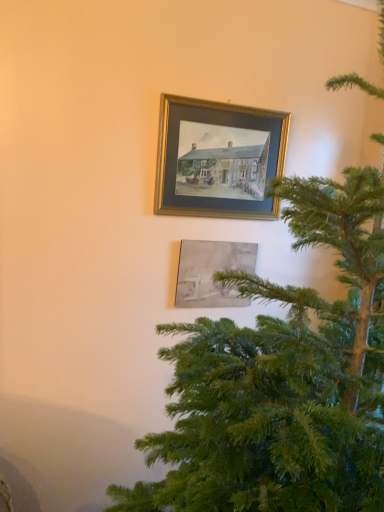
Question: Is gray matte painting at lower center, arranged as the 1th picture frame when ordered from the bottom, turned away from green textured christmas tree at right?

Choices:
 (A) yes
 (B) no

Answer: (B)

Question: Does gray matte painting at lower center, arranged as the second picture frame when viewed from the top, contain green textured christmas tree at right?

Choices:
 (A) yes
 (B) no

Answer: (B)

Question: Is gray matte painting at lower center, arranged as the second picture frame when viewed from the top, thinner than green textured christmas tree at right?

Choices:
 (A) no
 (B) yes

Answer: (B)

Question: From the image's perspective, would you say gray matte painting at lower center, arranged as the second picture frame when viewed from the top, is shown under green textured christmas tree at right?

Choices:
 (A) no
 (B) yes

Answer: (A)

Question: Is gray matte painting at lower center, arranged as the second picture frame when viewed from the top, at the right side of green textured christmas tree at right?

Choices:
 (A) no
 (B) yes

Answer: (A)

Question: Is green textured christmas tree at right next to gray matte painting at lower center, arranged as the 1th picture frame when ordered from the bottom?

Choices:
 (A) no
 (B) yes

Answer: (A)

Question: Is gray matte painting at lower center, arranged as the 1th picture frame when ordered from the bottom, at the back of green textured christmas tree at right?

Choices:
 (A) yes
 (B) no

Answer: (B)

Question: Considering the relative positions of green textured christmas tree at right and gray matte painting at lower center, arranged as the 1th picture frame when ordered from the bottom, in the image provided, is green textured christmas tree at right behind gray matte painting at lower center, arranged as the 1th picture frame when ordered from the bottom,?

Choices:
 (A) yes
 (B) no

Answer: (B)

Question: Does green textured christmas tree at right contain gray matte painting at lower center, arranged as the second picture frame when viewed from the top?

Choices:
 (A) no
 (B) yes

Answer: (A)

Question: Is there a large distance between green textured christmas tree at right and gray matte painting at lower center, arranged as the second picture frame when viewed from the top?

Choices:
 (A) no
 (B) yes

Answer: (A)

Question: Can we say green textured christmas tree at right lies outside gray matte painting at lower center, arranged as the second picture frame when viewed from the top?

Choices:
 (A) no
 (B) yes

Answer: (B)

Question: Is gray matte painting at lower center, arranged as the second picture frame when viewed from the top, at the right side of gold metallic picture frame at upper center, which is the 2th picture frame in bottom-to-top order?

Choices:
 (A) no
 (B) yes

Answer: (A)